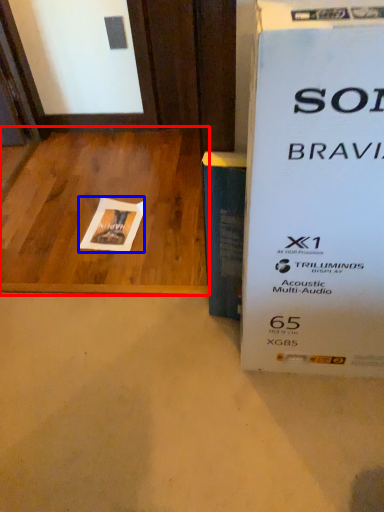
Question: Among these objects, which one is nearest to the camera, table (highlighted by a red box) or flyer (highlighted by a blue box)?

Choices:
 (A) table
 (B) flyer

Answer: (A)